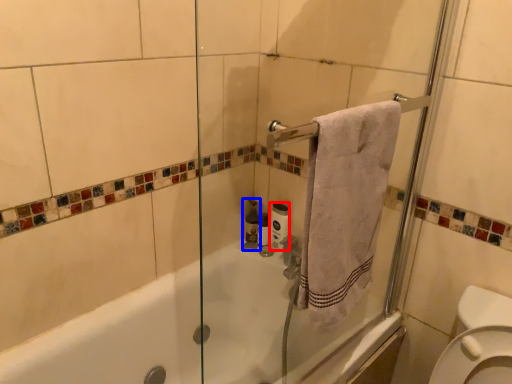
Question: Among these objects, which one is farthest to the camera, toilet paper (highlighted by a red box) or toiletry (highlighted by a blue box)?

Choices:
 (A) toilet paper
 (B) toiletry

Answer: (B)